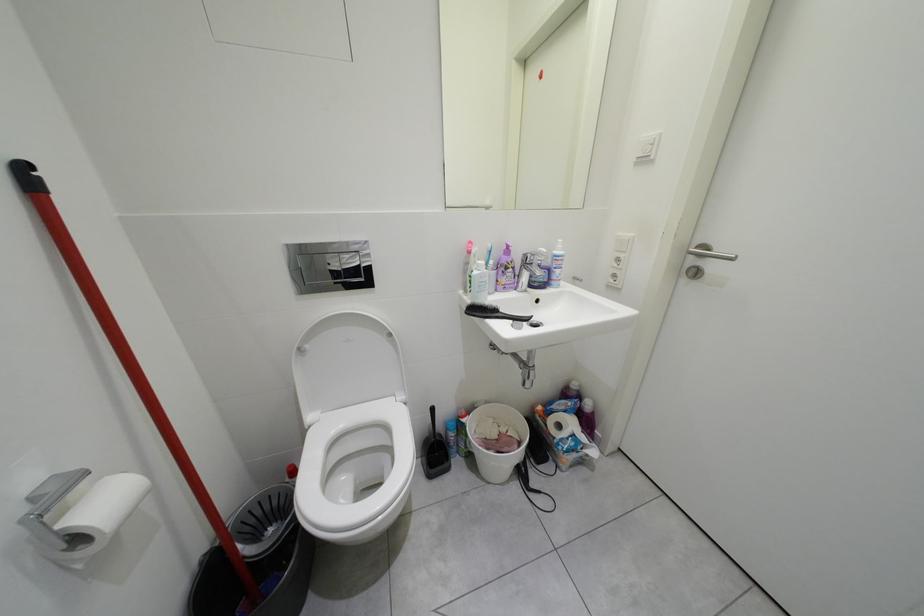
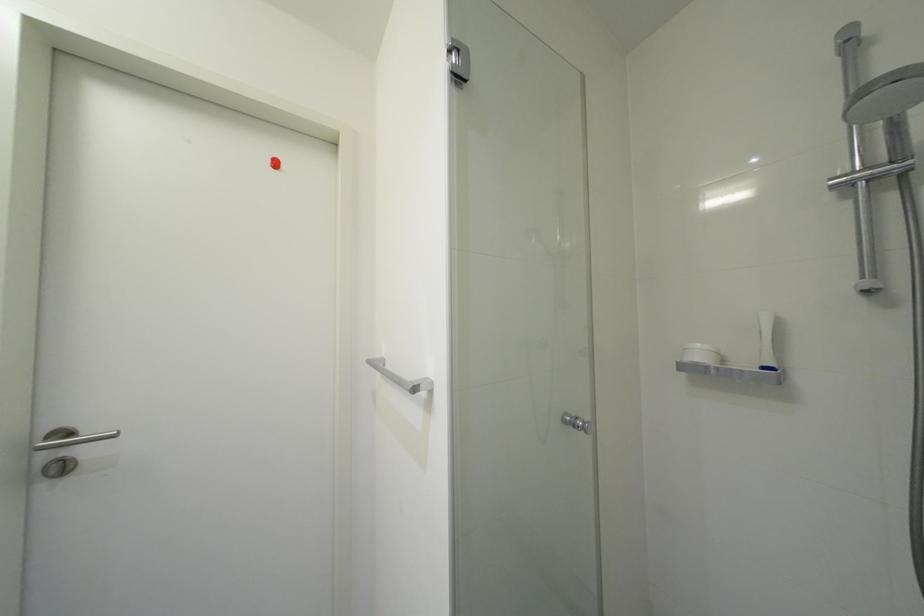
Question: How did the camera likely rotate?

Choices:
 (A) Left
 (B) Right
 (C) Up
 (D) Down

Answer: (B)